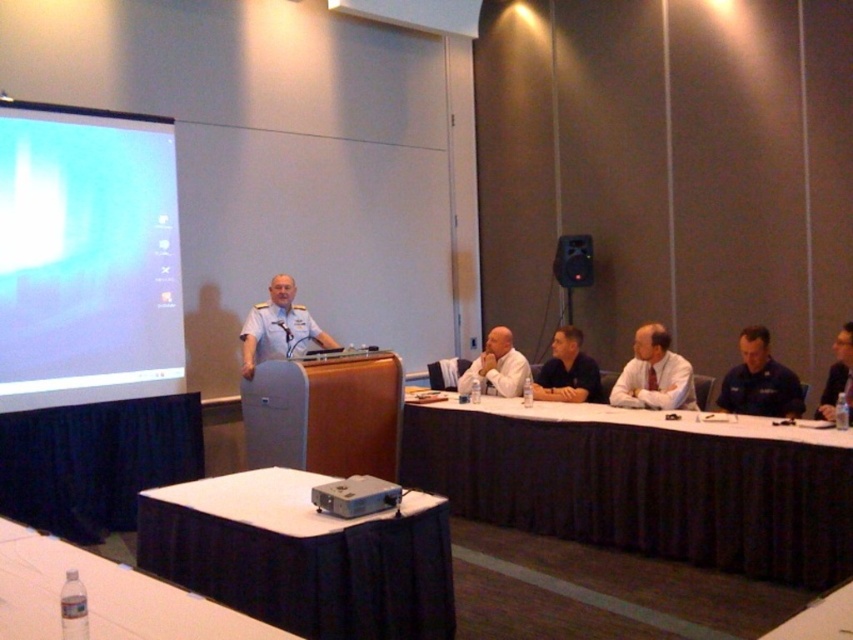
You are organizing a presentation and need to ensure that the white matte projection screen at upper left and the dark blue shirt at center are visible to all attendees. Based on their sizes, which object would appear larger to someone sitting at the back of the conference room?

The white matte projection screen at upper left would appear larger because its width surpasses that of the dark blue shirt at center.

You are standing in the conference room and want to reach both the point at coordinates [175,365] and the point at coordinates [553,340]. Which point should you approach first to reach the closer one first?

Point at coordinates [175,365] is closer to you than point at coordinates [553,340], so you should approach point at coordinates [175,365] first.